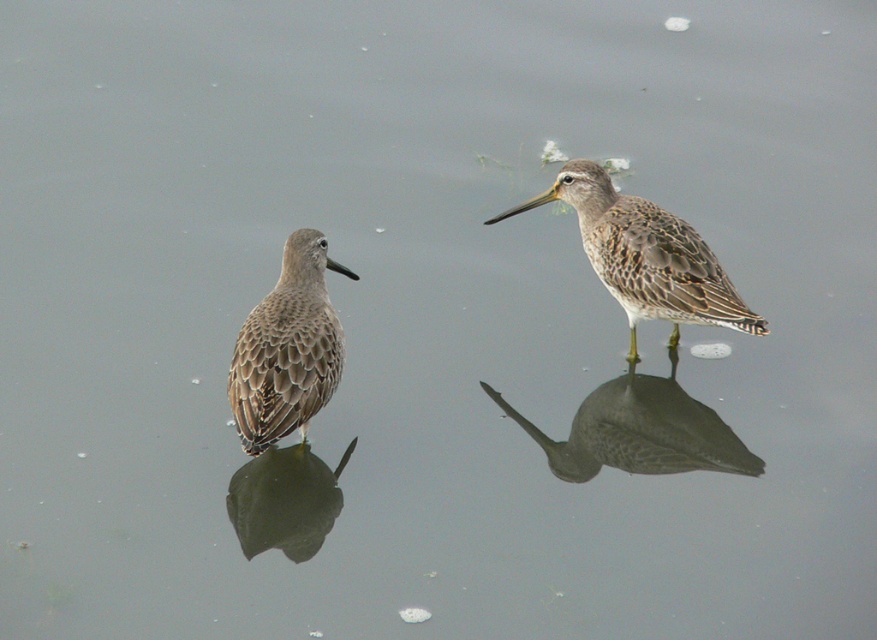
Question: Among these objects, which one is farthest from the camera?

Choices:
 (A) brown speckled sandpiper at right
 (B) brown speckled bird at right
 (C) brown feathered bird at lower left

Answer: (B)

Question: Does brown speckled sandpiper at right have a larger size compared to brown feathered bird at left?

Choices:
 (A) no
 (B) yes

Answer: (B)

Question: Where is brown feathered bird at left located in relation to brown feathered bird at lower left in the image?

Choices:
 (A) below
 (B) above

Answer: (B)

Question: Is brown speckled sandpiper at right to the right of brown feathered bird at left from the viewer's perspective?

Choices:
 (A) no
 (B) yes

Answer: (B)

Question: Which of the following is the closest to the observer?

Choices:
 (A) (279, 284)
 (B) (289, 524)
 (C) (646, 240)

Answer: (B)

Question: Among these points, which one is farthest from the camera?

Choices:
 (A) (600, 269)
 (B) (332, 477)
 (C) (560, 472)

Answer: (A)